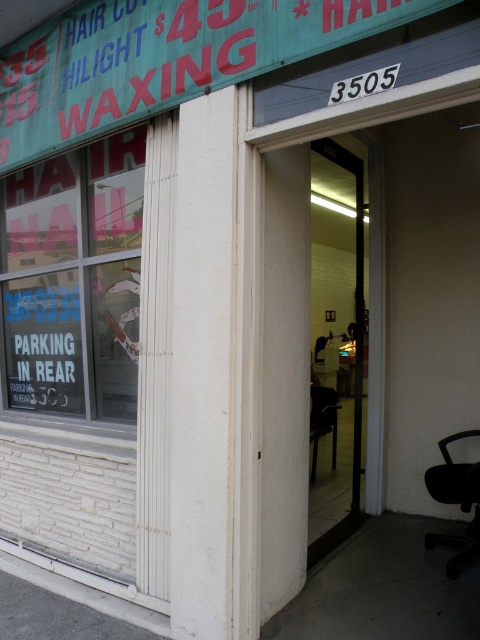
Between clear glass window at upper left and black plastic chair at center, which one appears on the left side from the viewer's perspective?

From the viewer's perspective, clear glass window at upper left appears more on the left side.

Is clear glass window at upper left to the left of black plastic chair at center from the viewer's perspective?

Indeed, clear glass window at upper left is positioned on the left side of black plastic chair at center.

Locate an element on the screen. The image size is (480, 640). clear glass window at upper left is located at coordinates (74, 280).

I want to click on clear glass window at upper left, so click(74, 280).

Describe the element at coordinates (74, 280) in the screenshot. The width and height of the screenshot is (480, 640). I see `clear glass window at upper left` at that location.

What do you see at coordinates (74, 280) in the screenshot?
I see `clear glass window at upper left` at bounding box center [74, 280].

Locate an element on the screen. The width and height of the screenshot is (480, 640). clear glass window at upper left is located at coordinates (74, 280).

Can you confirm if black plastic swivel chair at lower right is positioned below black plastic chair at center?

Yes.

Is the position of black plastic swivel chair at lower right less distant than that of black plastic chair at center?

That is True.

Describe the element at coordinates (456, 500) in the screenshot. I see `black plastic swivel chair at lower right` at that location.

The image size is (480, 640). I want to click on black plastic swivel chair at lower right, so click(x=456, y=500).